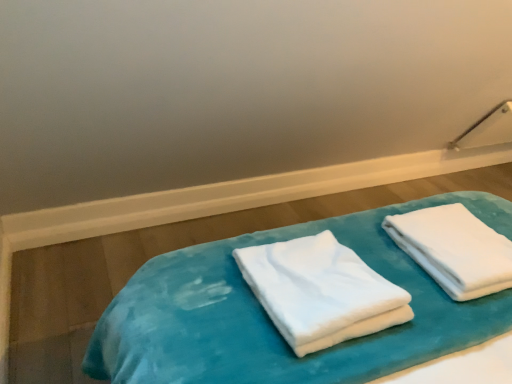
This screenshot has height=384, width=512. Find the location of `velvet blue bed at center`. velvet blue bed at center is located at coordinates (272, 322).

Find the location of `white soft towel at center, which is the second towel in right-to-left order`. white soft towel at center, which is the second towel in right-to-left order is located at coordinates (320, 291).

Between white soft towel at center, the first towel when ordered from left to right, and white soft towel at right, placed as the 2th towel when sorted from left to right, which one has larger size?

Bigger between the two is white soft towel at center, the first towel when ordered from left to right.

Which object is positioned more to the left, white soft towel at center, which is the second towel in right-to-left order, or white soft towel at right, acting as the 1th towel starting from the right?

From the viewer's perspective, white soft towel at center, which is the second towel in right-to-left order, appears more on the left side.

Which of these two, white soft towel at center, the first towel when ordered from left to right, or white soft towel at right, acting as the 1th towel starting from the right, stands taller?

white soft towel at center, the first towel when ordered from left to right.

Which point is more distant from viewer, (379, 276) or (413, 221)?

Positioned behind is point (413, 221).

Looking at this image, between white soft towel at right, acting as the 1th towel starting from the right, and white soft towel at center, which is the second towel in right-to-left order, which one appears on the left side from the viewer's perspective?

Positioned to the left is white soft towel at center, which is the second towel in right-to-left order.

Is white soft towel at right, acting as the 1th towel starting from the right, looking in the opposite direction of white soft towel at center, which is the second towel in right-to-left order?

No, white soft towel at right, acting as the 1th towel starting from the right, is not facing the opposite direction of white soft towel at center, which is the second towel in right-to-left order.

Considering the positions of points (472, 265) and (293, 242), is point (472, 265) closer to camera compared to point (293, 242)?

Yes, it is.

Is white soft towel at center, which is the second towel in right-to-left order, surrounded by white soft towel at right, placed as the 2th towel when sorted from left to right?

That's incorrect, white soft towel at center, which is the second towel in right-to-left order, is not inside white soft towel at right, placed as the 2th towel when sorted from left to right.

Which is in front, point (337, 368) or point (320, 233)?

The point (337, 368) is in front.

In the scene shown: Could you tell me if velvet blue bed at center is facing white soft towel at center, which is the second towel in right-to-left order?

No, velvet blue bed at center does not turn towards white soft towel at center, which is the second towel in right-to-left order.

What's the angular difference between velvet blue bed at center and white soft towel at center, which is the second towel in right-to-left order,'s facing directions?

They differ by 179 degrees in their facing directions.

Which of these two, velvet blue bed at center or white soft towel at center, the first towel when ordered from left to right, is smaller?

white soft towel at center, the first towel when ordered from left to right.

Between velvet blue bed at center and white soft towel at right, acting as the 1th towel starting from the right, which one has larger size?

velvet blue bed at center.

Which of these two, velvet blue bed at center or white soft towel at right, acting as the 1th towel starting from the right, stands taller?

white soft towel at right, acting as the 1th towel starting from the right.

Can you tell me how much velvet blue bed at center and white soft towel at right, acting as the 1th towel starting from the right, differ in facing direction?

They differ by 178 degrees in their facing directions.

Is velvet blue bed at center not within white soft towel at right, placed as the 2th towel when sorted from left to right?

Absolutely, velvet blue bed at center is external to white soft towel at right, placed as the 2th towel when sorted from left to right.

Is velvet blue bed at center at the back of white soft towel at center, which is the second towel in right-to-left order?

No, white soft towel at center, which is the second towel in right-to-left order, is not facing away from velvet blue bed at center.

Is white soft towel at center, which is the second towel in right-to-left order, outside of velvet blue bed at center?

Yes.

Is white soft towel at center, the first towel when ordered from left to right, taller than velvet blue bed at center?

Indeed, white soft towel at center, the first towel when ordered from left to right, has a greater height compared to velvet blue bed at center.

In the scene shown: Does white soft towel at right, acting as the 1th towel starting from the right, contain velvet blue bed at center?

Actually, velvet blue bed at center is outside white soft towel at right, acting as the 1th towel starting from the right.

Considering the sizes of objects white soft towel at right, placed as the 2th towel when sorted from left to right, and velvet blue bed at center in the image provided, who is taller, white soft towel at right, placed as the 2th towel when sorted from left to right, or velvet blue bed at center?

Standing taller between the two is white soft towel at right, placed as the 2th towel when sorted from left to right.

What are the coordinates of `bed on the right of white soft towel at right, placed as the 2th towel when sorted from left to right` in the screenshot? It's located at (272, 322).

Can you confirm if white soft towel at right, acting as the 1th towel starting from the right, is bigger than velvet blue bed at center?

Actually, white soft towel at right, acting as the 1th towel starting from the right, might be smaller than velvet blue bed at center.

At what (x,y) coordinates should I click in order to perform the action: click on towel that appears in front of the white soft towel at right, acting as the 1th towel starting from the right. Please return your answer as a coordinate pair (x, y). The width and height of the screenshot is (512, 384). Looking at the image, I should click on (320, 291).

Find the location of `towel that appears above the white soft towel at center, the first towel when ordered from left to right (from the image's perspective)`. towel that appears above the white soft towel at center, the first towel when ordered from left to right (from the image's perspective) is located at coordinates (454, 249).

Looking at the image, which one is located further to white soft towel at right, placed as the 2th towel when sorted from left to right, velvet blue bed at center or white soft towel at center, which is the second towel in right-to-left order?

Among the two, white soft towel at center, which is the second towel in right-to-left order, is located further to white soft towel at right, placed as the 2th towel when sorted from left to right.

When comparing their distances from white soft towel at center, which is the second towel in right-to-left order, does white soft towel at right, acting as the 1th towel starting from the right, or velvet blue bed at center seem further?

Based on the image, white soft towel at right, acting as the 1th towel starting from the right, appears to be further to white soft towel at center, which is the second towel in right-to-left order.

From the image, which object appears to be nearer to velvet blue bed at center, white soft towel at center, which is the second towel in right-to-left order, or white soft towel at right, acting as the 1th towel starting from the right?

white soft towel at center, which is the second towel in right-to-left order, is closer to velvet blue bed at center.

Considering their positions, is white soft towel at center, the first towel when ordered from left to right, positioned further to white soft towel at right, placed as the 2th towel when sorted from left to right, than velvet blue bed at center?

Among the two, white soft towel at center, the first towel when ordered from left to right, is located further to white soft towel at right, placed as the 2th towel when sorted from left to right.

Which object lies further to the anchor point white soft towel at center, which is the second towel in right-to-left order, velvet blue bed at center or white soft towel at right, placed as the 2th towel when sorted from left to right?

white soft towel at right, placed as the 2th towel when sorted from left to right, is further to white soft towel at center, which is the second towel in right-to-left order.

Looking at the image, which one is located further to velvet blue bed at center, white soft towel at right, acting as the 1th towel starting from the right, or white soft towel at center, the first towel when ordered from left to right?

white soft towel at right, acting as the 1th towel starting from the right.

Locate an element on the screen. The height and width of the screenshot is (384, 512). towel situated between white soft towel at center, the first towel when ordered from left to right, and velvet blue bed at center from left to right is located at coordinates (454, 249).